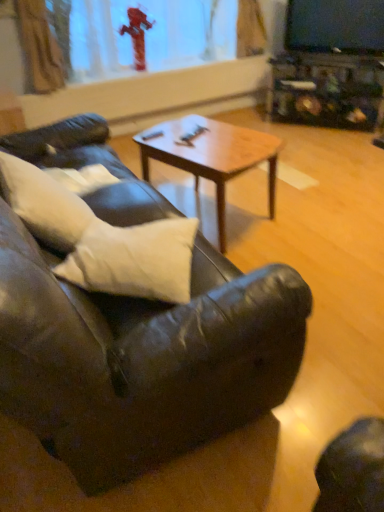
You are a GUI agent. You are given a task and a screenshot of the screen. Output one action in this format:
    pyautogui.click(x=<x>, y=<y>)
    Task: Click on the leather couch at center
    This screenshot has width=384, height=512.
    Given the screenshot: What is the action you would take?
    pyautogui.click(x=141, y=358)

Measure the distance between point (352, 36) and camera.

They are 3.75 meters apart.

Based on the photo, what is the approximate width of woodenmaterial/texturecoffee table at center?

woodenmaterial/texturecoffee table at center is 21.25 inches wide.

Locate an element on the screen. transparent glass fire hydrant at upper center is located at coordinates (149, 35).

I want to click on studio couch on the left of woodenmaterial/texturecoffee table at center, so click(141, 358).

Could you tell me if woodenmaterial/texturecoffee table at center is turned towards leather couch at center?

Yes, woodenmaterial/texturecoffee table at center is facing leather couch at center.

Is point (222, 170) positioned before point (237, 407)?

No, it is not.

Considering the sizes of woodenmaterial/texturecoffee table at center and leather couch at center in the image, is woodenmaterial/texturecoffee table at center taller or shorter than leather couch at center?

Clearly, woodenmaterial/texturecoffee table at center is shorter compared to leather couch at center.

Consider the image. Which of these two, transparent glass fire hydrant at upper center or white matte pillow at left, acting as the 1th pillow starting from the left, is smaller?

white matte pillow at left, acting as the 1th pillow starting from the left.

Is transparent glass fire hydrant at upper center behind white matte pillow at left, acting as the second pillow starting from the right?

Yes, the depth of transparent glass fire hydrant at upper center is greater than that of white matte pillow at left, acting as the second pillow starting from the right.

Is transparent glass fire hydrant at upper center not inside white matte pillow at left, acting as the second pillow starting from the right?

Absolutely, transparent glass fire hydrant at upper center is external to white matte pillow at left, acting as the second pillow starting from the right.

How different are the orientations of transparent glass fire hydrant at upper center and white matte pillow at left, acting as the 1th pillow starting from the left, in degrees?

There is a 94.7-degree angle between the facing directions of transparent glass fire hydrant at upper center and white matte pillow at left, acting as the 1th pillow starting from the left.

What's the angular difference between white matte pillow at left, acting as the 1th pillow starting from the left, and woodenmaterial/texturecoffee table at center's facing directions?

167 degrees.

Choose the correct answer: Is white matte pillow at left, acting as the second pillow starting from the right, inside woodenmaterial/texturecoffee table at center or outside it?

white matte pillow at left, acting as the second pillow starting from the right, is located beyond the bounds of woodenmaterial/texturecoffee table at center.

Are white matte pillow at left, acting as the 1th pillow starting from the left, and woodenmaterial/texturecoffee table at center located far from each other?

No.

Where is `coffee table located underneath the white matte pillow at left, acting as the 1th pillow starting from the left (from a real-world perspective)`? The image size is (384, 512). coffee table located underneath the white matte pillow at left, acting as the 1th pillow starting from the left (from a real-world perspective) is located at coordinates (211, 156).

From a real-world perspective, between black glossy tv at upper right and transparent glass fire hydrant at upper center, who is vertically lower?

From a 3D spatial view, black glossy tv at upper right is below.

Is black glossy tv at upper right facing towards transparent glass fire hydrant at upper center?

No, black glossy tv at upper right is not oriented towards transparent glass fire hydrant at upper center.

Does black glossy tv at upper right have a greater width compared to transparent glass fire hydrant at upper center?

In fact, black glossy tv at upper right might be narrower than transparent glass fire hydrant at upper center.

Which is nearer, (303, 42) or (128, 59)?

Point (303, 42) is farther from the camera than point (128, 59).

Which object is more forward, white matte pillow at left, acting as the second pillow starting from the right, or white soft pillow at center, the second pillow in the left-to-right sequence?

white matte pillow at left, acting as the second pillow starting from the right.

Does point (78, 283) come closer to viewer compared to point (168, 300)?

No, (78, 283) is behind (168, 300).

Is white matte pillow at left, acting as the 1th pillow starting from the left, facing away from white soft pillow at center, the second pillow in the left-to-right sequence?

That's not correct — white matte pillow at left, acting as the 1th pillow starting from the left, is not looking away from white soft pillow at center, the second pillow in the left-to-right sequence.

Would you consider white matte pillow at left, acting as the second pillow starting from the right, to be distant from white soft pillow at center, the second pillow in the left-to-right sequence?

No.

Which point is more forward, (x=333, y=51) or (x=171, y=260)?

The point (x=171, y=260) is in front.

In terms of height, does black glossy tv at upper right look taller or shorter compared to white soft pillow at center, which is counted as the first pillow, starting from the right?

Considering their sizes, black glossy tv at upper right has more height than white soft pillow at center, which is counted as the first pillow, starting from the right.

Is black glossy tv at upper right positioned with its back to white soft pillow at center, the second pillow in the left-to-right sequence?

black glossy tv at upper right is not turned away from white soft pillow at center, the second pillow in the left-to-right sequence.

From a real-world perspective, does black glossy tv at upper right sit lower than white soft pillow at center, the second pillow in the left-to-right sequence?

No.

Considering the sizes of black glossy tv at upper right and woodenmaterial/texturecoffee table at center in the image, is black glossy tv at upper right taller or shorter than woodenmaterial/texturecoffee table at center?

black glossy tv at upper right is shorter than woodenmaterial/texturecoffee table at center.

Is black glossy tv at upper right facing towards woodenmaterial/texturecoffee table at center?

Yes, black glossy tv at upper right is turned towards woodenmaterial/texturecoffee table at center.

In the image, is black glossy tv at upper right positioned in front of or behind woodenmaterial/texturecoffee table at center?

Visually, black glossy tv at upper right is located behind woodenmaterial/texturecoffee table at center.

Where is `studio couch that is on the left side of woodenmaterial/texturecoffee table at center`? The image size is (384, 512). studio couch that is on the left side of woodenmaterial/texturecoffee table at center is located at coordinates (141, 358).

Where is `window screen that is on the right side of white matte pillow at left, acting as the 1th pillow starting from the left`? This screenshot has height=512, width=384. window screen that is on the right side of white matte pillow at left, acting as the 1th pillow starting from the left is located at coordinates pos(149,35).

From the image, which object appears to be nearer to black glossy tv at upper right, leather couch at center or white soft pillow at center, the second pillow in the left-to-right sequence?

The object closer to black glossy tv at upper right is white soft pillow at center, the second pillow in the left-to-right sequence.

Based on their spatial positions, is transparent glass fire hydrant at upper center or white matte pillow at left, acting as the second pillow starting from the right, further from black glossy tv at upper right?

The object further to black glossy tv at upper right is white matte pillow at left, acting as the second pillow starting from the right.

From the image, which object appears to be nearer to leather couch at center, black glossy tv at upper right or white matte pillow at left, acting as the second pillow starting from the right?

Among the two, white matte pillow at left, acting as the second pillow starting from the right, is located nearer to leather couch at center.

Estimate the real-world distances between objects in this image. Which object is further from white soft pillow at center, the second pillow in the left-to-right sequence, woodenmaterial/texturecoffee table at center or transparent glass fire hydrant at upper center?

transparent glass fire hydrant at upper center lies further to white soft pillow at center, the second pillow in the left-to-right sequence, than the other object.

Consider the image. When comparing their distances from white matte pillow at left, acting as the second pillow starting from the right, does black glossy tv at upper right or transparent glass fire hydrant at upper center seem further?

black glossy tv at upper right is further to white matte pillow at left, acting as the second pillow starting from the right.

Looking at this image, looking at the image, which one is located closer to leather couch at center, black glossy tv at upper right or woodenmaterial/texturecoffee table at center?

woodenmaterial/texturecoffee table at center.

Estimate the real-world distances between objects in this image. Which object is closer to leather couch at center, white soft pillow at center, which is counted as the first pillow, starting from the right, or transparent glass fire hydrant at upper center?

Among the two, white soft pillow at center, which is counted as the first pillow, starting from the right, is located nearer to leather couch at center.

Considering their positions, is white soft pillow at center, the second pillow in the left-to-right sequence, positioned further to black glossy tv at upper right than leather couch at center?

leather couch at center.

The image size is (384, 512). I want to click on television between transparent glass fire hydrant at upper center and woodenmaterial/texturecoffee table at center vertically, so click(x=335, y=26).

At what (x,y) coordinates should I click in order to perform the action: click on pillow between white matte pillow at left, acting as the 1th pillow starting from the left, and transparent glass fire hydrant at upper center, along the z-axis. Please return your answer as a coordinate pair (x, y). The height and width of the screenshot is (512, 384). Looking at the image, I should click on (134, 260).

Identify the location of coffee table between leather couch at center and transparent glass fire hydrant at upper center along the z-axis. (211, 156).

You are a GUI agent. You are given a task and a screenshot of the screen. Output one action in this format:
    pyautogui.click(x=<x>, y=<y>)
    Task: Click on the pillow positioned between white matte pillow at left, acting as the second pillow starting from the right, and black glossy tv at upper right from near to far
    The image size is (384, 512).
    Given the screenshot: What is the action you would take?
    pyautogui.click(x=134, y=260)